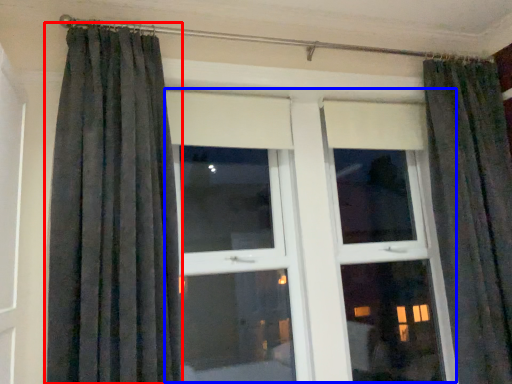
Question: Among these objects, which one is nearest to the camera, curtain (highlighted by a red box) or bay window (highlighted by a blue box)?

Choices:
 (A) curtain
 (B) bay window

Answer: (A)